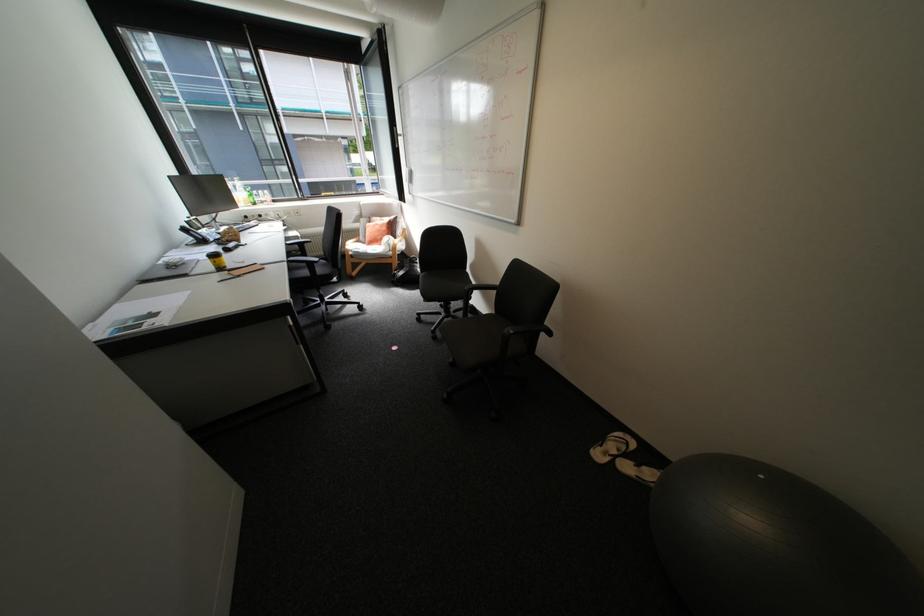
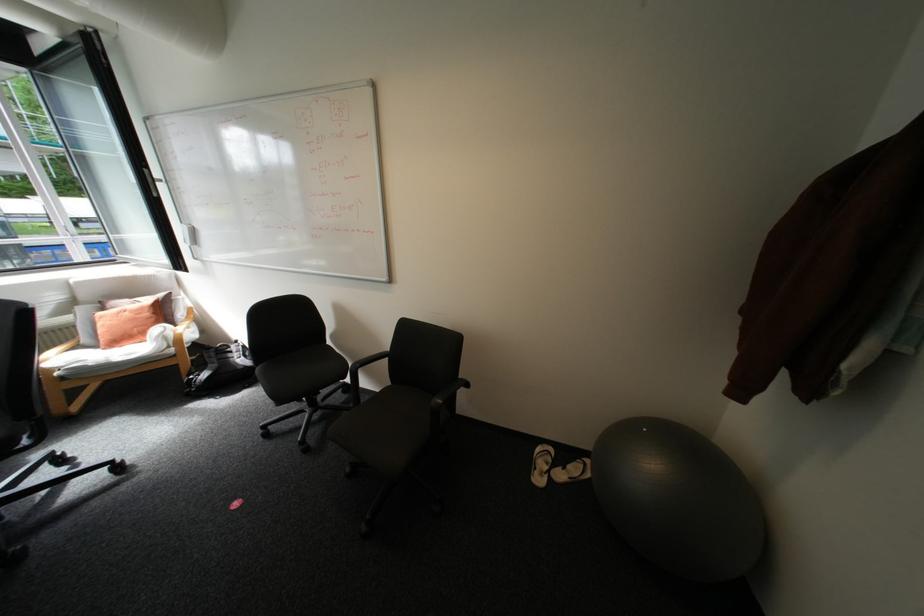
Question: The camera is either moving clockwise (left) or counter-clockwise (right) around the object. The first image is from the beginning of the video and the second image is from the end. Is the camera moving left or right when shooting the video?

Choices:
 (A) Left
 (B) Right

Answer: (A)